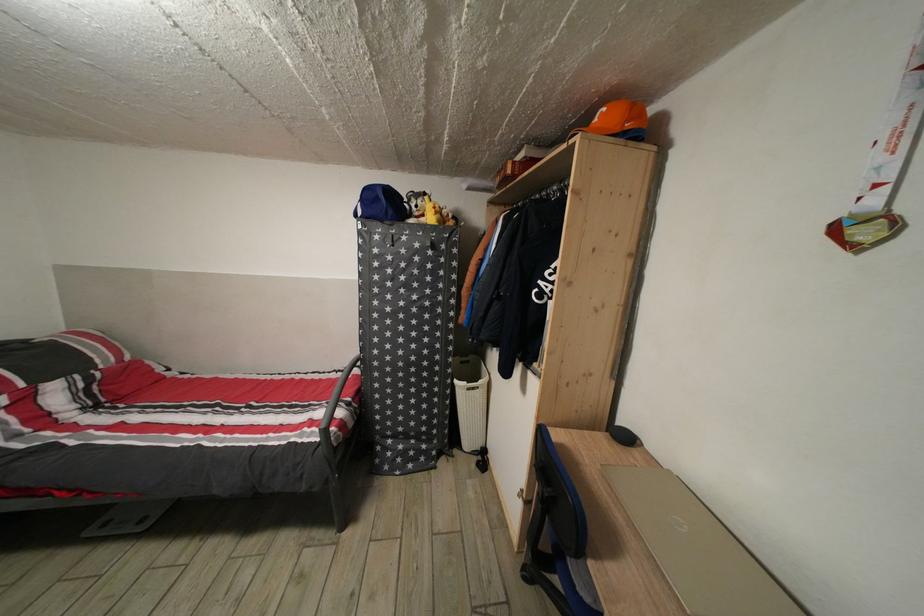
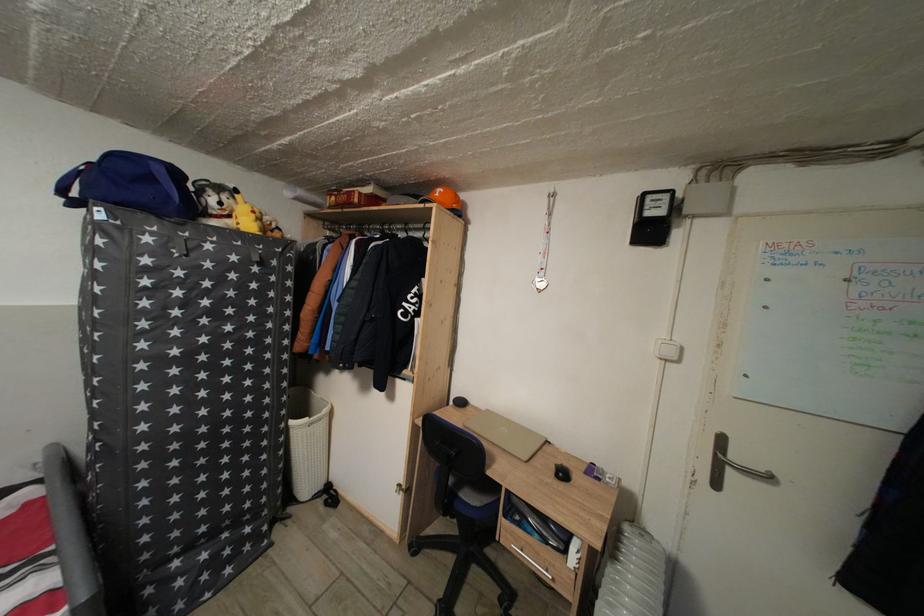
Question: The camera is either moving clockwise (left) or counter-clockwise (right) around the object. The first image is from the beginning of the video and the second image is from the end. Is the camera moving left or right when shooting the video?

Choices:
 (A) Left
 (B) Right

Answer: (A)